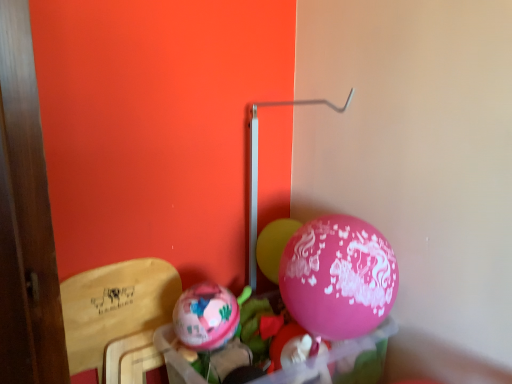
What do you see at coordinates (206, 316) in the screenshot?
I see `matte pink balloon at center, the 2th balloon when ordered from back to front` at bounding box center [206, 316].

Identify the location of matte pink balloon at center, which ranks as the 1th balloon in front-to-back order. The height and width of the screenshot is (384, 512). (206, 316).

Does pink glossy balloon at center, arranged as the first balloon when viewed from the right, turn towards wooden armchair at left?

No, pink glossy balloon at center, arranged as the first balloon when viewed from the right, does not turn towards wooden armchair at left.

From the image's perspective, is pink glossy balloon at center, which appears as the first balloon when viewed from the back, above wooden armchair at left?

Indeed, from the image's perspective, pink glossy balloon at center, which appears as the first balloon when viewed from the back, is shown above wooden armchair at left.

In terms of width, does pink glossy balloon at center, acting as the 2th balloon starting from the left, look wider or thinner when compared to wooden armchair at left?

In the image, pink glossy balloon at center, acting as the 2th balloon starting from the left, appears to be more narrow than wooden armchair at left.

Would you say wooden armchair at left is part of pink glossy balloon at center, acting as the 2th balloon starting from the left,'s contents?

No, pink glossy balloon at center, acting as the 2th balloon starting from the left, does not contain wooden armchair at left.

Between wooden armchair at left and pink glossy balloon at center, acting as the 2th balloon starting from the left, which one has smaller width?

pink glossy balloon at center, acting as the 2th balloon starting from the left, is thinner.

Is point (121, 317) behind point (271, 223)?

No, it is not.

What's the angular difference between wooden armchair at left and pink glossy balloon at center, acting as the 2th balloon starting from the left,'s facing directions?

The facing directions of wooden armchair at left and pink glossy balloon at center, acting as the 2th balloon starting from the left, are 27.1 degrees apart.

Based on the photo, which object is positioned more to the left, wooden armchair at left or pink glossy balloon at center, which is counted as the second balloon, starting from the front?

wooden armchair at left is more to the left.

Considering the positions of objects pink glossy balloon at center, acting as the 2th balloon starting from the left, and matte pink balloon at center, which ranks as the 1th balloon in front-to-back order, in the image provided, who is more to the left, pink glossy balloon at center, acting as the 2th balloon starting from the left, or matte pink balloon at center, which ranks as the 1th balloon in front-to-back order,?

Positioned to the left is matte pink balloon at center, which ranks as the 1th balloon in front-to-back order.

Is pink glossy balloon at center, which appears as the first balloon when viewed from the back, spatially inside matte pink balloon at center, the 1th balloon when ordered from left to right, or outside of it?

pink glossy balloon at center, which appears as the first balloon when viewed from the back, is located beyond the bounds of matte pink balloon at center, the 1th balloon when ordered from left to right.

Is pink glossy balloon at center, which appears as the first balloon when viewed from the back, directly adjacent to matte pink balloon at center, the 2th balloon when ordered from back to front?

pink glossy balloon at center, which appears as the first balloon when viewed from the back, and matte pink balloon at center, the 2th balloon when ordered from back to front, are not in contact.

Based on the photo, does pink glossy balloon at center, which appears as the first balloon when viewed from the back, have a lesser width compared to matte pink balloon at center, the 1th balloon when ordered from left to right?

Incorrect, the width of pink glossy balloon at center, which appears as the first balloon when viewed from the back, is not less than that of matte pink balloon at center, the 1th balloon when ordered from left to right.

Which is behind, point (202, 315) or point (158, 319)?

Point (158, 319)

From a real-world perspective, is matte pink balloon at center, which ranks as the 1th balloon in front-to-back order, positioned over wooden armchair at left based on gravity?

Yes, from a real-world perspective, matte pink balloon at center, which ranks as the 1th balloon in front-to-back order, is on top of wooden armchair at left.

Is wooden armchair at left at the back of matte pink balloon at center, the 2th balloon when ordered from back to front?

Yes.

Is matte pink balloon at center, the 2th balloon when ordered from back to front, wider or thinner than wooden armchair at left?

Considering their sizes, matte pink balloon at center, the 2th balloon when ordered from back to front, looks slimmer than wooden armchair at left.

Between matte pink balloon at center, the 2th balloon when ordered from back to front, and pink glossy balloon at center, acting as the 2th balloon starting from the left, which one appears on the left side from the viewer's perspective?

Positioned to the left is matte pink balloon at center, the 2th balloon when ordered from back to front.

From a real-world perspective, relative to pink glossy balloon at center, acting as the 2th balloon starting from the left, is matte pink balloon at center, the 2th balloon when ordered from back to front, vertically above or below?

matte pink balloon at center, the 2th balloon when ordered from back to front, is situated lower than pink glossy balloon at center, acting as the 2th balloon starting from the left, in the real world.

Based on the photo, from the image's perspective, is matte pink balloon at center, the 2th balloon when ordered from back to front, beneath pink glossy balloon at center, arranged as the first balloon when viewed from the right?

Yes, from the image's perspective, matte pink balloon at center, the 2th balloon when ordered from back to front, is below pink glossy balloon at center, arranged as the first balloon when viewed from the right.

Is wooden armchair at left turned away from matte pink balloon at center, which ranks as the 1th balloon in front-to-back order?

No, wooden armchair at left is not facing away from matte pink balloon at center, which ranks as the 1th balloon in front-to-back order.

How many degrees apart are the facing directions of wooden armchair at left and matte pink balloon at center, the 1th balloon when ordered from left to right?

The angular difference between wooden armchair at left and matte pink balloon at center, the 1th balloon when ordered from left to right, is 8.32 degrees.

Considering the relative sizes of wooden armchair at left and matte pink balloon at center, which ranks as the 1th balloon in front-to-back order, in the image provided, is wooden armchair at left shorter than matte pink balloon at center, which ranks as the 1th balloon in front-to-back order,?

In fact, wooden armchair at left may be taller than matte pink balloon at center, which ranks as the 1th balloon in front-to-back order.

From the image's perspective, between wooden armchair at left and matte pink balloon at center, the 2th balloon when ordered from back to front, who is located below?

wooden armchair at left is shown below in the image.

At what (x,y) coordinates should I click in order to perform the action: click on armchair below the pink glossy balloon at center, arranged as the first balloon when viewed from the right (from the image's perspective). Please return your answer as a coordinate pair (x, y). Looking at the image, I should click on (115, 306).

This screenshot has width=512, height=384. Find the location of `the 2nd balloon behind the wooden armchair at left, counting from the anchor's position`. the 2nd balloon behind the wooden armchair at left, counting from the anchor's position is located at coordinates tap(274, 245).

Based on their spatial positions, is matte pink balloon at center, the 2th balloon when ordered from back to front, or pink glossy balloon at center, arranged as the first balloon when viewed from the right, closer to wooden armchair at left?

matte pink balloon at center, the 2th balloon when ordered from back to front.

When comparing their distances from matte pink balloon at center, positioned as the second balloon in right-to-left order, does pink glossy balloon at center, which is counted as the second balloon, starting from the front, or wooden armchair at left seem further?

pink glossy balloon at center, which is counted as the second balloon, starting from the front.

Considering their positions, is matte pink balloon at center, the 2th balloon when ordered from back to front, positioned further to pink glossy balloon at center, arranged as the first balloon when viewed from the right, than wooden armchair at left?

wooden armchair at left is further to pink glossy balloon at center, arranged as the first balloon when viewed from the right.

Which object lies further to the anchor point wooden armchair at left, pink glossy balloon at center, which appears as the first balloon when viewed from the back, or matte pink balloon at center, which ranks as the 1th balloon in front-to-back order?

pink glossy balloon at center, which appears as the first balloon when viewed from the back, lies further to wooden armchair at left than the other object.

Estimate the real-world distances between objects in this image. Which object is closer to matte pink balloon at center, positioned as the second balloon in right-to-left order, wooden armchair at left or pink glossy balloon at center, which appears as the first balloon when viewed from the back?

wooden armchair at left is positioned closer to the anchor matte pink balloon at center, positioned as the second balloon in right-to-left order.

Consider the image. Based on their spatial positions, is wooden armchair at left or matte pink balloon at center, positioned as the second balloon in right-to-left order, closer to pink glossy balloon at center, which is counted as the second balloon, starting from the front?

Based on the image, matte pink balloon at center, positioned as the second balloon in right-to-left order, appears to be nearer to pink glossy balloon at center, which is counted as the second balloon, starting from the front.

The image size is (512, 384). I want to click on balloon situated between wooden armchair at left and pink glossy balloon at center, arranged as the first balloon when viewed from the right, from left to right, so click(206, 316).